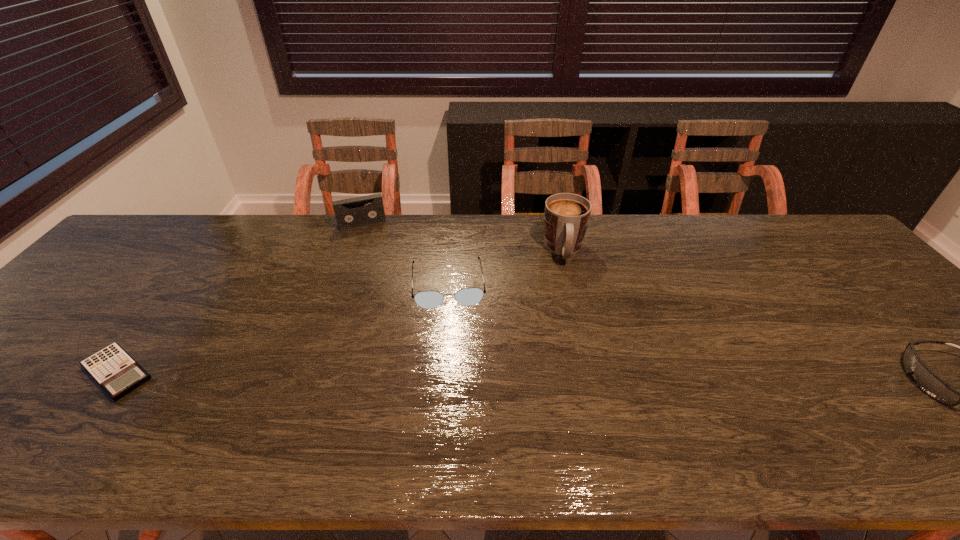
Find the location of a particular element. vacant space at the far edge of the desktop is located at coordinates (220, 255).

The height and width of the screenshot is (540, 960). I want to click on free space at the near edge, so click(549, 411).

Where is `free point at the left edge`? free point at the left edge is located at coordinates (123, 280).

Locate an element on the screen. The width and height of the screenshot is (960, 540). free region at the right edge of the desktop is located at coordinates (847, 266).

This screenshot has width=960, height=540. Find the location of `blank area at the far left corner`. blank area at the far left corner is located at coordinates (147, 235).

The image size is (960, 540). Find the location of `vacant area that lies between the mug and the spectacles`. vacant area that lies between the mug and the spectacles is located at coordinates (506, 267).

The height and width of the screenshot is (540, 960). I want to click on vacant area that lies between the fourth object from right to left and the leftmost object, so click(x=240, y=298).

This screenshot has width=960, height=540. In order to click on empty space that is in between the leftmost object and the third object from left to right in this screenshot , I will do click(x=282, y=328).

Where is `free point between the shortest object and the mug`? This screenshot has width=960, height=540. free point between the shortest object and the mug is located at coordinates pos(341,312).

The width and height of the screenshot is (960, 540). Find the location of `vacant area between the third object from right to left and the leftmost object`. vacant area between the third object from right to left and the leftmost object is located at coordinates (282, 328).